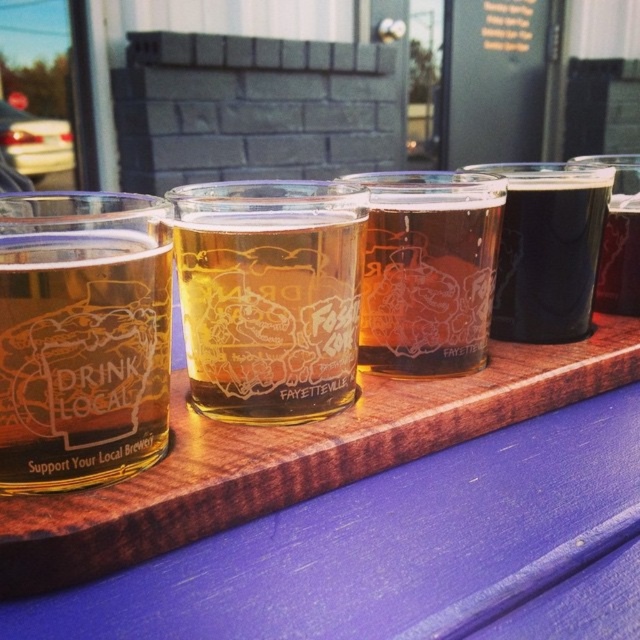
You are at a local brewery event and want to choose a glass for your drink. You prefer a larger glass. Based on the scene, which glass should you pick between the translucent glass beer glass at center and the black matte glass at center?

The black matte glass at center is larger than the translucent glass beer glass at center, so you should choose the black matte glass at center for a larger glass.

You are setting up a display for a local brewery event. You have a wooden tray at center and a translucent glass at center. Considering their heights, which item should you place underneath the other to ensure stability?

The wooden tray at center has a lesser height compared to the translucent glass at center, so you should place the wooden tray at center underneath the translucent glass at center to ensure stability.